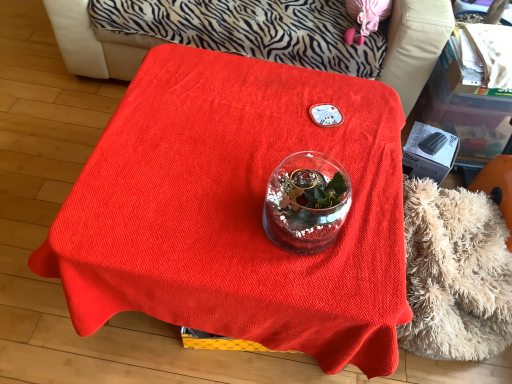
Locate an element on the screen. This screenshot has width=512, height=384. vacant area in front of transparent glass vase at center is located at coordinates (303, 283).